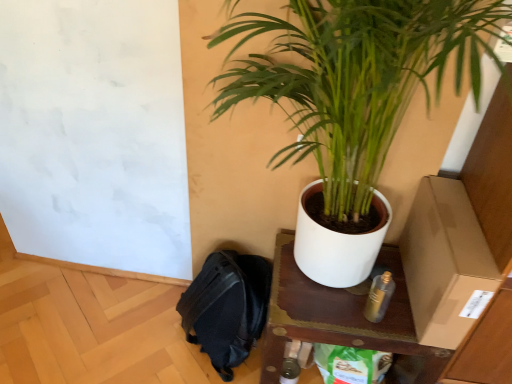
Question: From the image's perspective, relative to brown cardboard box at right, is wooden table at center above or below?

Choices:
 (A) below
 (B) above

Answer: (A)

Question: Looking at the image, does wooden table at center seem bigger or smaller compared to brown cardboard box at right?

Choices:
 (A) big
 (B) small

Answer: (A)

Question: Which is nearer to the brown cardboard box at right?

Choices:
 (A) green glossy plant at upper right
 (B) metallic gold spray can at lower right
 (C) wooden table at center
 (D) black fabric backpack at lower left

Answer: (B)

Question: Considering the real-world distances, which object is closest to the wooden table at center?

Choices:
 (A) green glossy plant at upper right
 (B) black fabric backpack at lower left
 (C) brown cardboard box at right
 (D) metallic gold spray can at lower right

Answer: (D)